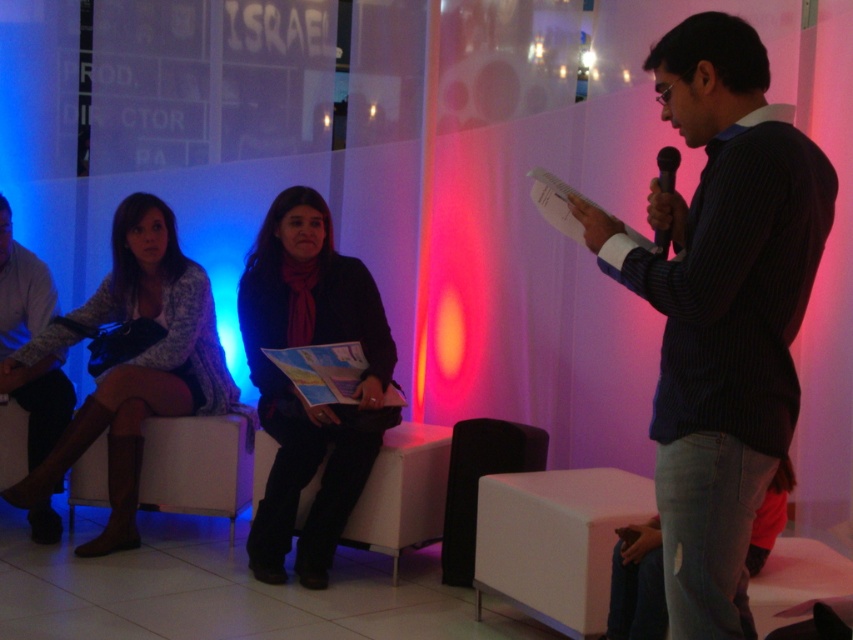
Is blue striped shirt at center thinner than white fabric chair at center?

Correct, blue striped shirt at center's width is less than white fabric chair at center's.

The width and height of the screenshot is (853, 640). Identify the location of blue striped shirt at center. (721, 308).

Where is `blue striped shirt at center`? The width and height of the screenshot is (853, 640). blue striped shirt at center is located at coordinates (721, 308).

Does blue striped shirt at center have a lesser width compared to matte black jacket at center?

Indeed, blue striped shirt at center has a lesser width compared to matte black jacket at center.

Who is more forward, [683,22] or [312,269]?

Point [683,22]

Based on the photo, who is more forward, (714, 19) or (286, 276)?

Point (714, 19) is more forward.

Identify the location of blue striped shirt at center. (721, 308).

Is the position of blue striped shirt at center more distant than that of light brown leather shoes at lower left?

No, it is in front of light brown leather shoes at lower left.

Does blue striped shirt at center have a greater height compared to light brown leather shoes at lower left?

In fact, blue striped shirt at center may be shorter than light brown leather shoes at lower left.

Is point (691, 232) more distant than point (53, 364)?

No, (691, 232) is closer to viewer.

You are a GUI agent. You are given a task and a screenshot of the screen. Output one action in this format:
    pyautogui.click(x=<x>, y=<y>)
    Task: Click on the blue striped shirt at center
    This screenshot has height=640, width=853.
    Given the screenshot: What is the action you would take?
    pyautogui.click(x=721, y=308)